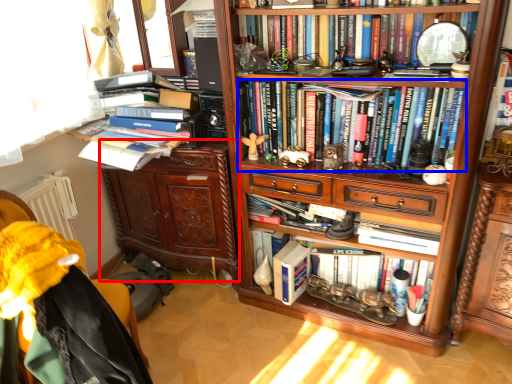
Question: Which of the following is the closest to the observer, cabinetry (highlighted by a red box) or book (highlighted by a blue box)?

Choices:
 (A) cabinetry
 (B) book

Answer: (B)